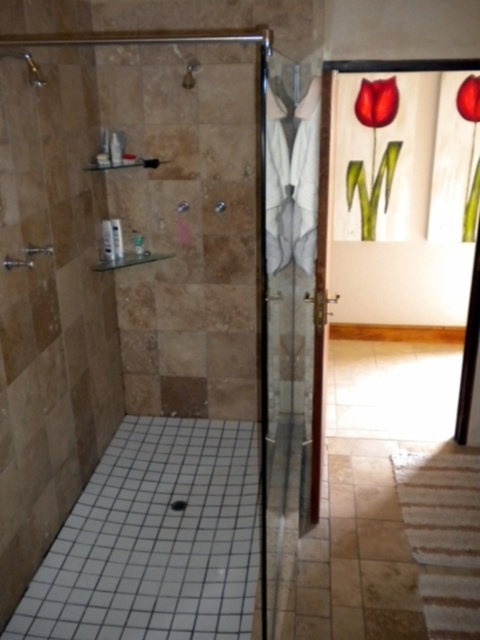
You are standing in the bathroom and see the point marked at coordinates [470,150]. What object is located at that point?

The point at [470,150] corresponds to the red glass tulip at upper right.

From the picture: You are standing in the bathroom and see the point marked at coordinates (470, 150). What object is located at that point?

The point at coordinates (470, 150) corresponds to the red glass tulip at upper right.